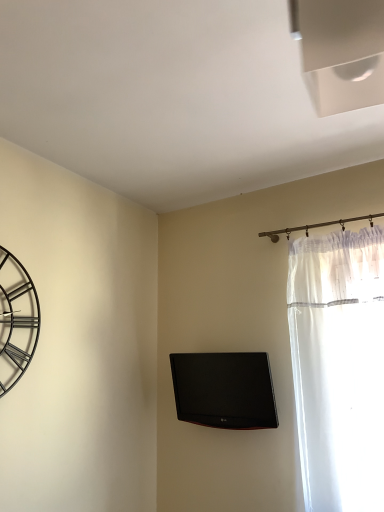
What do you see at coordinates (16, 320) in the screenshot? I see `metallic black clock at left` at bounding box center [16, 320].

Identify the location of metallic black clock at left. (16, 320).

What do you see at coordinates (224, 390) in the screenshot? I see `black glossy tv at center` at bounding box center [224, 390].

This screenshot has width=384, height=512. Identify the location of black glossy tv at center. (224, 390).

Locate an element on the screen. metallic black clock at left is located at coordinates (16, 320).

Is black glossy tv at center at the left side of metallic black clock at left?

No, black glossy tv at center is not to the left of metallic black clock at left.

From the picture: Is black glossy tv at center in front of or behind metallic black clock at left in the image?

In the image, black glossy tv at center appears behind metallic black clock at left.

Considering the points (209, 379) and (22, 368), which point is in front, point (209, 379) or point (22, 368)?

The point (22, 368) is closer.

From the image's perspective, is black glossy tv at center above or below metallic black clock at left?

Clearly, from the image's perspective, black glossy tv at center is below metallic black clock at left.

From a real-world perspective, between black glossy tv at center and metallic black clock at left, who is vertically higher?

In real-world perspective, metallic black clock at left is above.

Which object is wider, black glossy tv at center or metallic black clock at left?

black glossy tv at center.

Between black glossy tv at center and metallic black clock at left, which one has more height?

metallic black clock at left is taller.

Between black glossy tv at center and metallic black clock at left, which one has smaller size?

metallic black clock at left.

Would you say black glossy tv at center is outside metallic black clock at left?

black glossy tv at center is positioned outside metallic black clock at left.

Based on the photo, are black glossy tv at center and metallic black clock at left far apart?

black glossy tv at center is actually quite close to metallic black clock at left.

Is black glossy tv at center oriented towards metallic black clock at left?

Yes, black glossy tv at center is oriented towards metallic black clock at left.

How many degrees apart are the facing directions of black glossy tv at center and metallic black clock at left?

The facing directions of black glossy tv at center and metallic black clock at left are 89.2 degrees apart.

The height and width of the screenshot is (512, 384). What are the coordinates of `television behind the metallic black clock at left` in the screenshot? It's located at (224, 390).

Considering the relative positions of metallic black clock at left and black glossy tv at center in the image provided, is metallic black clock at left to the left of black glossy tv at center from the viewer's perspective?

Yes.

Considering the positions of objects metallic black clock at left and black glossy tv at center in the image provided, who is behind, metallic black clock at left or black glossy tv at center?

black glossy tv at center is further away from the camera.

Between point (6, 255) and point (240, 371), which one is positioned behind?

The point (240, 371) is behind.

From the image's perspective, between metallic black clock at left and black glossy tv at center, which one is located above?

metallic black clock at left appears higher in the image.

From a real-world perspective, between metallic black clock at left and black glossy tv at center, who is vertically higher?

metallic black clock at left, from a real-world perspective.

Which of these two, metallic black clock at left or black glossy tv at center, is thinner?

metallic black clock at left is thinner.

Which of these two, metallic black clock at left or black glossy tv at center, stands shorter?

Standing shorter between the two is black glossy tv at center.

Considering the sizes of objects metallic black clock at left and black glossy tv at center in the image provided, who is smaller, metallic black clock at left or black glossy tv at center?

metallic black clock at left is smaller.

Is metallic black clock at left outside of black glossy tv at center?

Absolutely, metallic black clock at left is external to black glossy tv at center.

Is metallic black clock at left next to black glossy tv at center?

There is a gap between metallic black clock at left and black glossy tv at center.

Is metallic black clock at left facing towards black glossy tv at center?

No, metallic black clock at left is not turned towards black glossy tv at center.

The width and height of the screenshot is (384, 512). I want to click on wall clock to the left of black glossy tv at center, so click(16, 320).

Find the location of a particular element. wall clock in front of the black glossy tv at center is located at coordinates point(16,320).

Where is `television below the metallic black clock at left (from the image's perspective)`? television below the metallic black clock at left (from the image's perspective) is located at coordinates (224, 390).